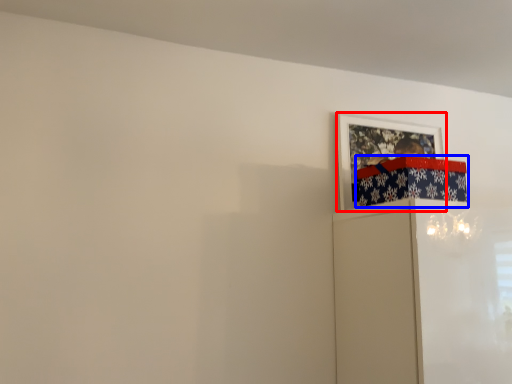
Question: Which object appears farthest to the camera in this image, picture frame (highlighted by a red box) or wrapping paper (highlighted by a blue box)?

Choices:
 (A) picture frame
 (B) wrapping paper

Answer: (A)